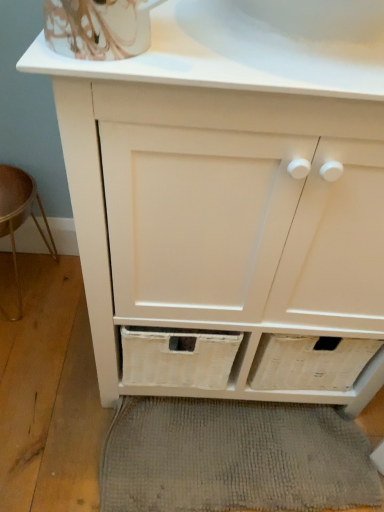
Question: From the image's perspective, is white porcelain sink at upper center located above wooden stool at lower left?

Choices:
 (A) yes
 (B) no

Answer: (A)

Question: Does white porcelain sink at upper center appear on the left side of wooden stool at lower left?

Choices:
 (A) no
 (B) yes

Answer: (A)

Question: Does white porcelain sink at upper center have a lesser width compared to wooden stool at lower left?

Choices:
 (A) no
 (B) yes

Answer: (A)

Question: Does white porcelain sink at upper center appear on the right side of wooden stool at lower left?

Choices:
 (A) yes
 (B) no

Answer: (A)

Question: From a real-world perspective, does white porcelain sink at upper center stand above wooden stool at lower left?

Choices:
 (A) no
 (B) yes

Answer: (B)

Question: Considering the positions of gray woven bath mat at lower center and white porcelain sink at upper center in the image, is gray woven bath mat at lower center bigger or smaller than white porcelain sink at upper center?

Choices:
 (A) big
 (B) small

Answer: (A)

Question: Considering the positions of gray woven bath mat at lower center and white porcelain sink at upper center in the image, is gray woven bath mat at lower center wider or thinner than white porcelain sink at upper center?

Choices:
 (A) thin
 (B) wide

Answer: (A)

Question: In terms of height, does gray woven bath mat at lower center look taller or shorter compared to white porcelain sink at upper center?

Choices:
 (A) tall
 (B) short

Answer: (A)

Question: Does point (281, 450) appear closer or farther from the camera than point (271, 54)?

Choices:
 (A) farther
 (B) closer

Answer: (A)

Question: From a real-world perspective, is wooden stool at lower left physically located above or below gray woven bath mat at lower center?

Choices:
 (A) below
 (B) above

Answer: (B)

Question: Considering the positions of wooden stool at lower left and gray woven bath mat at lower center in the image, is wooden stool at lower left taller or shorter than gray woven bath mat at lower center?

Choices:
 (A) short
 (B) tall

Answer: (B)

Question: Do you think wooden stool at lower left is within gray woven bath mat at lower center, or outside of it?

Choices:
 (A) outside
 (B) inside

Answer: (A)

Question: Considering the positions of wooden stool at lower left and gray woven bath mat at lower center in the image, is wooden stool at lower left bigger or smaller than gray woven bath mat at lower center?

Choices:
 (A) small
 (B) big

Answer: (B)

Question: Which is correct: white porcelain sink at upper center is inside gray woven bath mat at lower center, or outside of it?

Choices:
 (A) outside
 (B) inside

Answer: (A)

Question: From the image's perspective, relative to gray woven bath mat at lower center, is white porcelain sink at upper center above or below?

Choices:
 (A) below
 (B) above

Answer: (B)